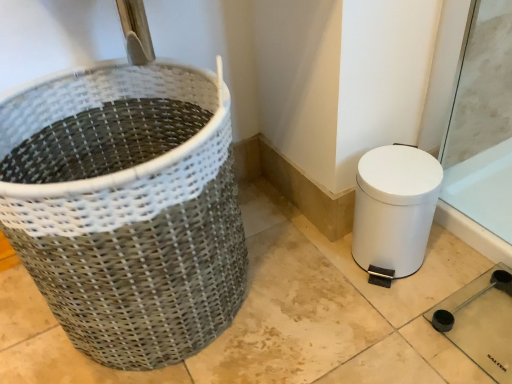
Question: From the image's perspective, is white matte toilet bowl at lower right located above or below natural woven basket at left?

Choices:
 (A) below
 (B) above

Answer: (A)

Question: In terms of height, does white matte toilet bowl at lower right look taller or shorter compared to natural woven basket at left?

Choices:
 (A) short
 (B) tall

Answer: (A)

Question: Is white matte toilet bowl at lower right wider or thinner than natural woven basket at left?

Choices:
 (A) thin
 (B) wide

Answer: (A)

Question: Would you say natural woven basket at left is to the left or to the right of white matte toilet bowl at lower right in the picture?

Choices:
 (A) right
 (B) left

Answer: (B)

Question: Is natural woven basket at left spatially inside white matte toilet bowl at lower right, or outside of it?

Choices:
 (A) inside
 (B) outside

Answer: (B)

Question: From the image's perspective, relative to white matte toilet bowl at lower right, is natural woven basket at left above or below?

Choices:
 (A) below
 (B) above

Answer: (B)

Question: In the image, is natural woven basket at left positioned in front of or behind white matte toilet bowl at lower right?

Choices:
 (A) front
 (B) behind

Answer: (A)